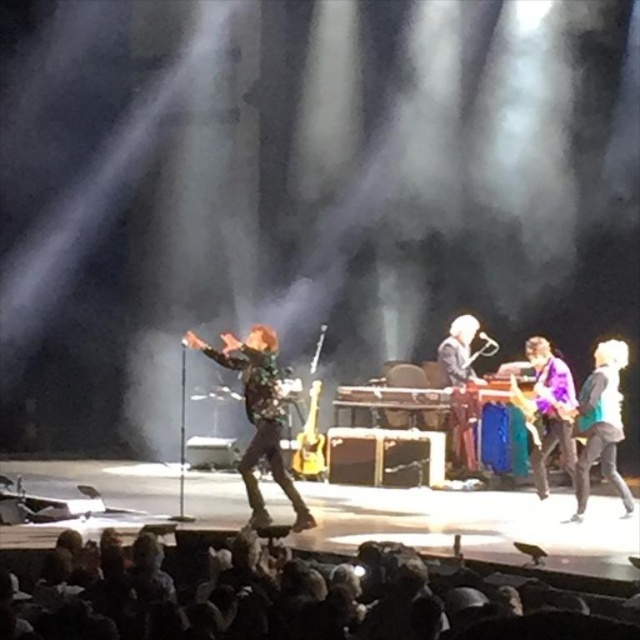
Question: Does flannel shirt at center have a greater width compared to shiny silver guitar at center?

Choices:
 (A) no
 (B) yes

Answer: (B)

Question: Which object is positioned farthest from the shiny silver guitar at center?

Choices:
 (A) purple glossy guitar at right
 (B) teal fabric jacket at right

Answer: (B)

Question: Considering the relative positions of teal fabric jacket at right and shiny silver guitar at center in the image provided, where is teal fabric jacket at right located with respect to shiny silver guitar at center?

Choices:
 (A) left
 (B) right

Answer: (B)

Question: Based on their relative distances, which object is nearer to the teal fabric jacket at right?

Choices:
 (A) shiny silver guitar at center
 (B) purple glossy guitar at right

Answer: (B)

Question: Can you confirm if teal fabric jacket at right is positioned to the left of shiny silver guitar at center?

Choices:
 (A) no
 (B) yes

Answer: (A)

Question: Which of the following is the farthest from the observer?

Choices:
 (A) flannel shirt at center
 (B) shiny silver guitar at center

Answer: (B)